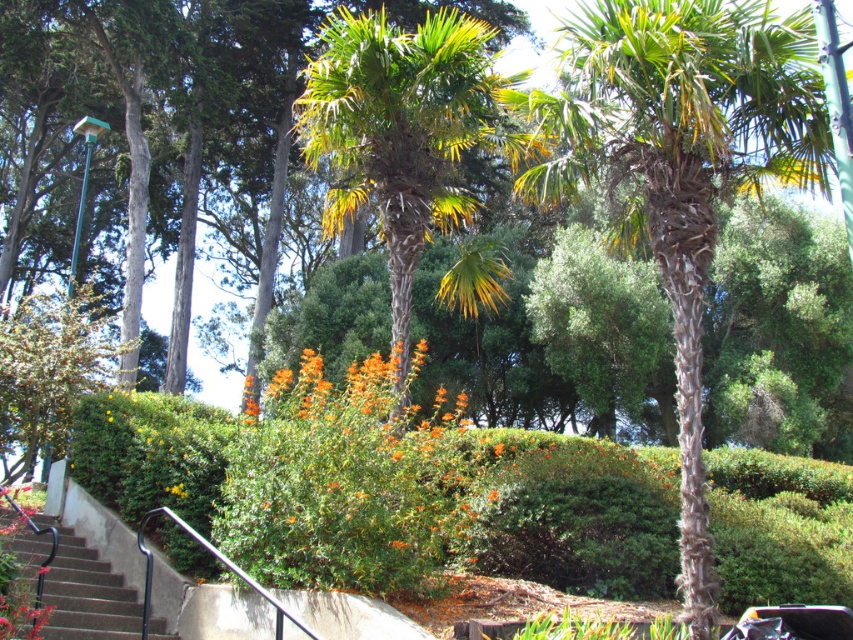
You are a gardener who needs to trim the green textured palm tree at center and the green leafy palm at center. Which one is closer to the ground?

The green textured palm tree at center is closer to the ground because it is positioned under the green leafy palm at center.

You are a landscape architect designing a pathway. You have to place a bench between the green leafy palm at center and the metallic gray stairs at lower left. Which side of the bench should face the wider object?

The green leafy palm at center is wider than the metallic gray stairs at lower left. Therefore, the bench should face the green leafy palm at center to align with the wider object.